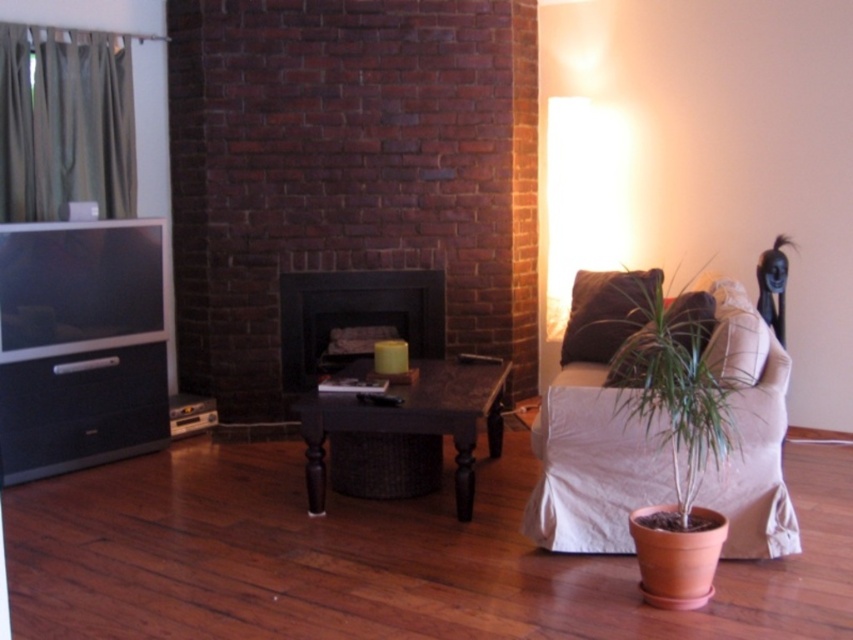
Which is more to the right, brown wicker table at center or matte black fireplace at center?

brown wicker table at center

Which is in front, point (457, 499) or point (300, 364)?

Point (457, 499)

Find the location of a particular element. brown wicker table at center is located at coordinates (412, 419).

Does point (628, 358) come farther from viewer compared to point (314, 330)?

No, it is in front of (314, 330).

Which is more to the left, green matte plant at lower right or matte black fireplace at center?

matte black fireplace at center is more to the left.

Consider the image. Who is more forward, (596, 307) or (415, 332)?

Point (596, 307) is in front.

Where is `green matte plant at lower right`? The width and height of the screenshot is (853, 640). green matte plant at lower right is located at coordinates pyautogui.click(x=659, y=368).

What do you see at coordinates (659, 368) in the screenshot? I see `green matte plant at lower right` at bounding box center [659, 368].

Which is behind, point (740, 380) or point (482, 394)?

The point (482, 394) is behind.

Which is in front, point (618, 310) or point (498, 435)?

Positioned in front is point (618, 310).

You are a GUI agent. You are given a task and a screenshot of the screen. Output one action in this format:
    pyautogui.click(x=<x>, y=<y>)
    Task: Click on the green matte plant at lower right
    The width and height of the screenshot is (853, 640).
    Given the screenshot: What is the action you would take?
    pyautogui.click(x=659, y=368)